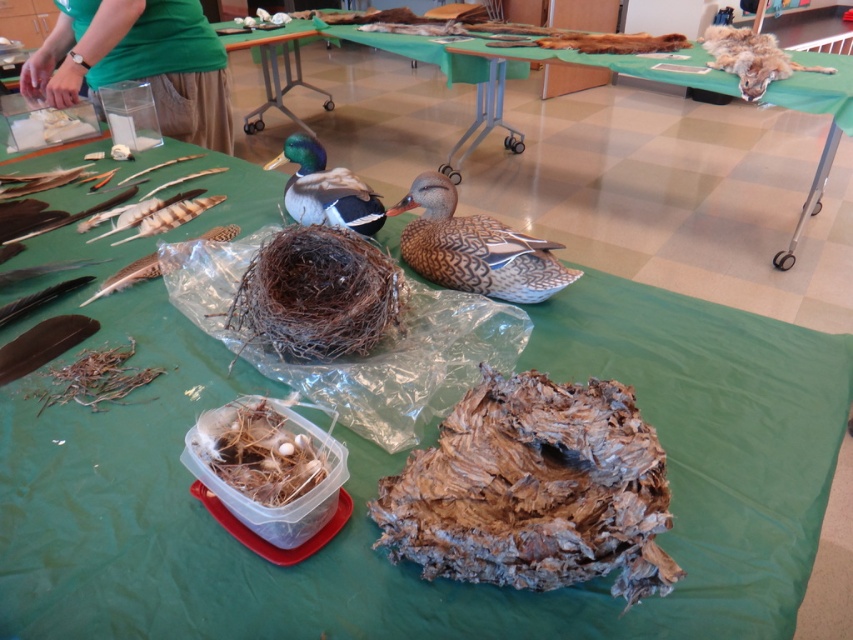
Question: Which is farther from the wooden duck at center?

Choices:
 (A) brown speckled duck at center
 (B) shiny green duck at center

Answer: (A)

Question: Which object is farther from the camera taking this photo?

Choices:
 (A) shiny green duck at center
 (B) wooden duck at center
 (C) green plastic table at center

Answer: (C)

Question: Which of the following is the closest to the observer?

Choices:
 (A) fuzzy brown fur at upper right
 (B) shiny green duck at center
 (C) brown speckled duck at center

Answer: (C)

Question: Is green fabric shirt at upper left smaller than brown speckled duck at center?

Choices:
 (A) yes
 (B) no

Answer: (B)

Question: Is shiny green duck at center positioned in front of fuzzy brown fur at upper right?

Choices:
 (A) yes
 (B) no

Answer: (A)

Question: Is brown speckled duck at center behind green plastic table at center?

Choices:
 (A) yes
 (B) no

Answer: (B)